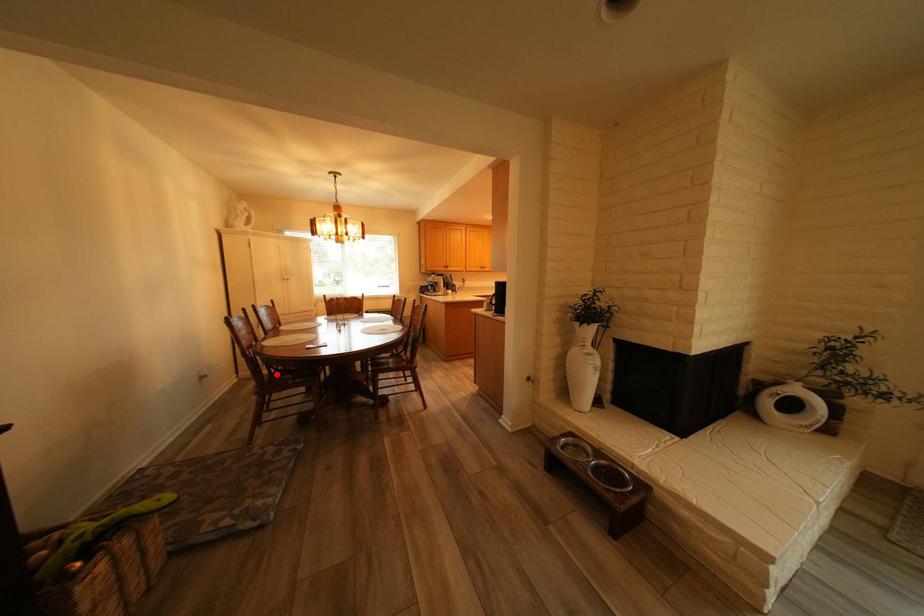
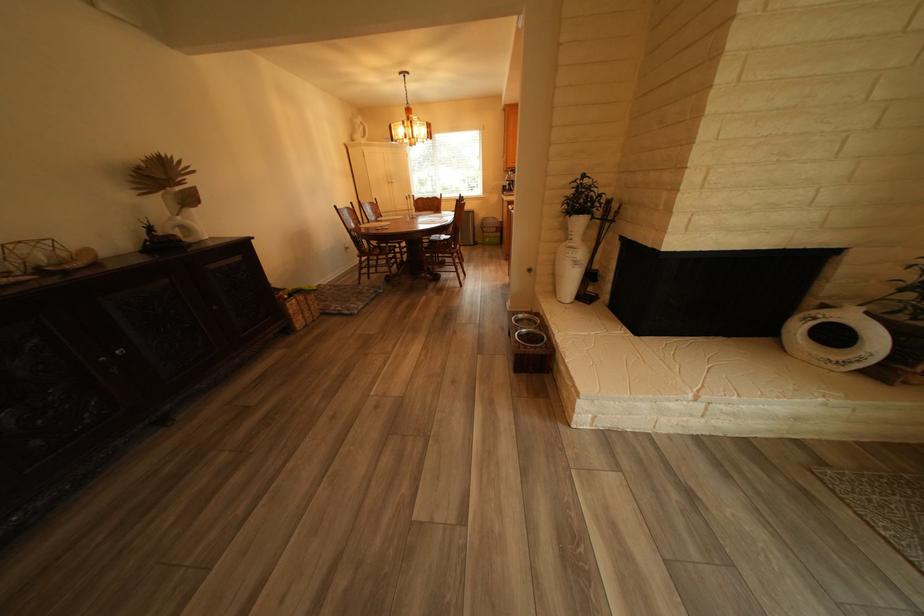
Question: I am providing you with two images of the same scene from different viewpoints. Image1 has a red point marked. In image2, the corresponding 3D location appears at what relative position? Reply with the corresponding letter.

Choices:
 (A) Closer
 (B) Farther

Answer: (A)